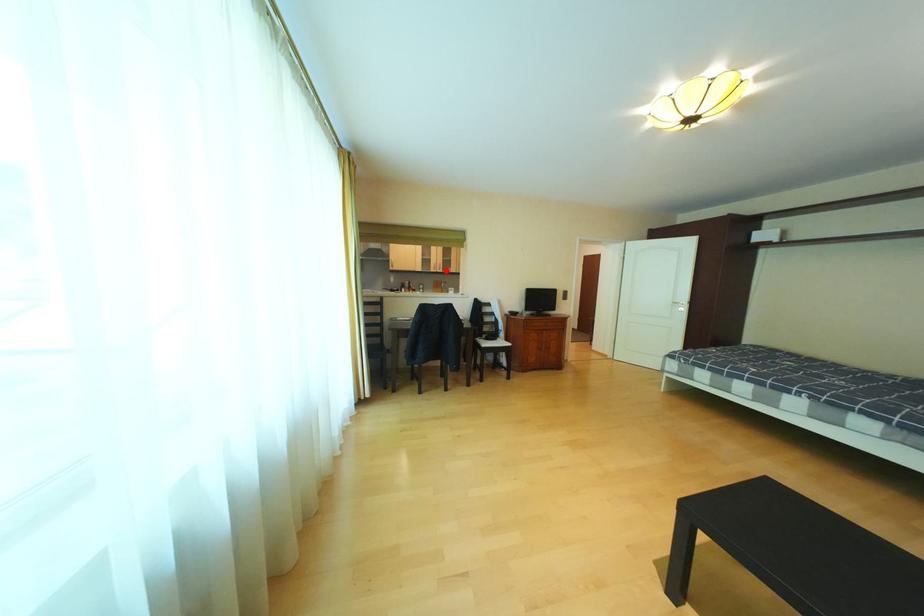
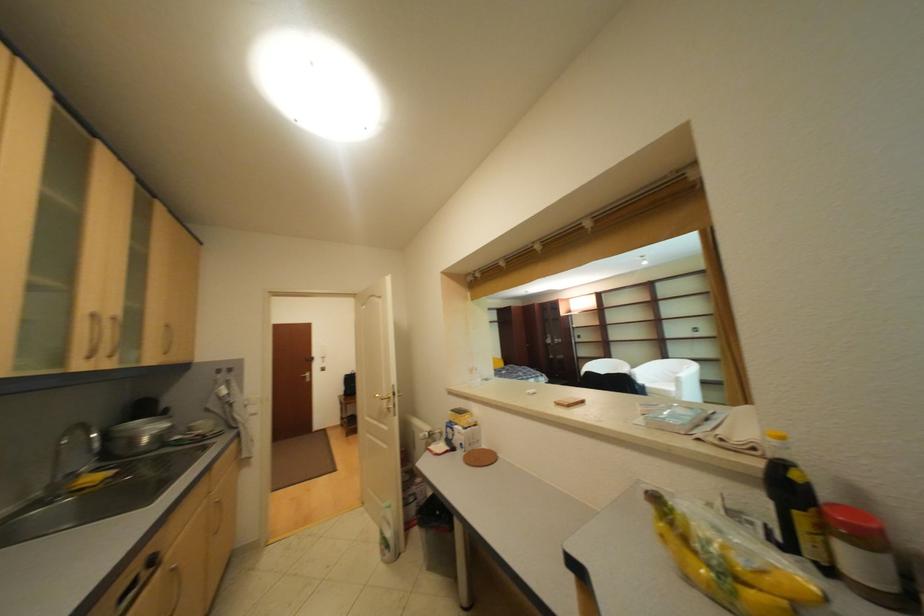
In the second image, find the point that corresponds to the highlighted location in the first image.

(101, 359)